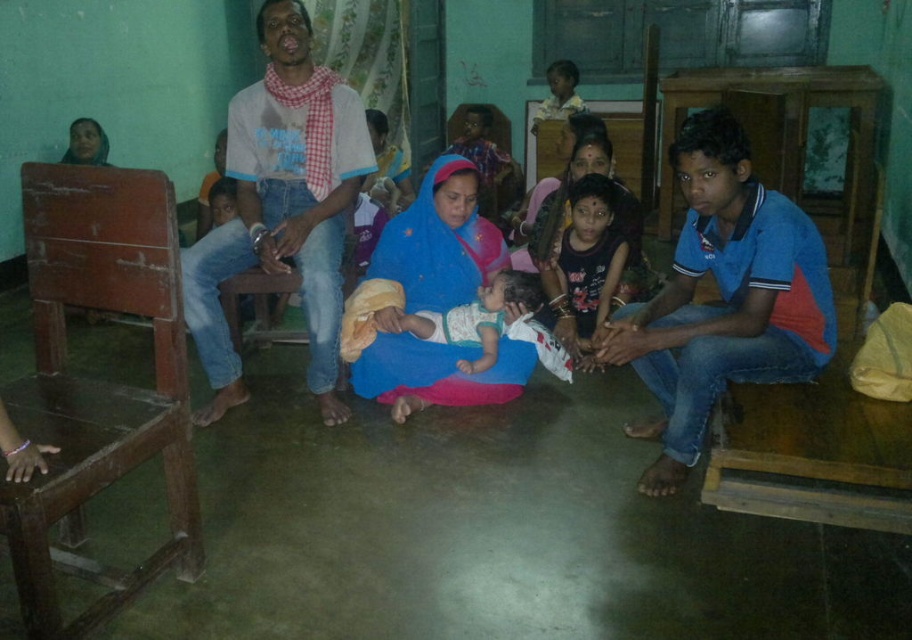
Question: Estimate the real-world distances between objects in this image. Which object is closer to the blue cotton shirt at right?

Choices:
 (A) white cotton shirt at center
 (B) white soft fabric baby at center

Answer: (B)

Question: Which point appears closest to the camera in this image?

Choices:
 (A) (70, 211)
 (B) (748, 292)
 (C) (570, 307)
 (D) (517, 289)

Answer: (A)

Question: Does blue cotton shirt at right lie in front of blue fabric at center?

Choices:
 (A) yes
 (B) no

Answer: (A)

Question: Estimate the real-world distances between objects in this image. Which object is farther from the light brown wooden chair at upper center?

Choices:
 (A) dark blue fabric dress at center
 (B) blue cotton shirt at right

Answer: (B)

Question: Can you confirm if white cotton shirt at center is wider than blue fabric at center?

Choices:
 (A) no
 (B) yes

Answer: (A)

Question: Does wooden chair at left appear over dark blue fabric dress at center?

Choices:
 (A) yes
 (B) no

Answer: (B)